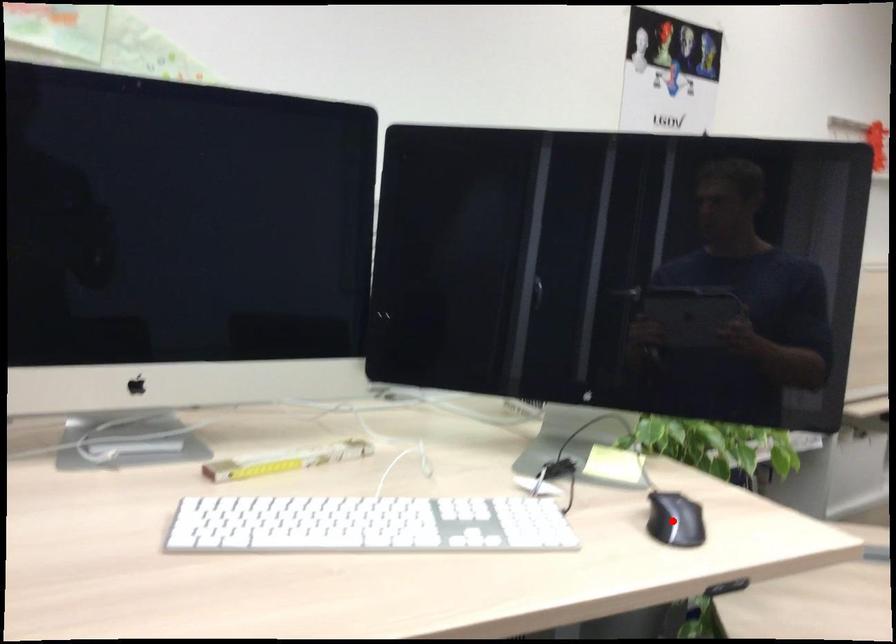
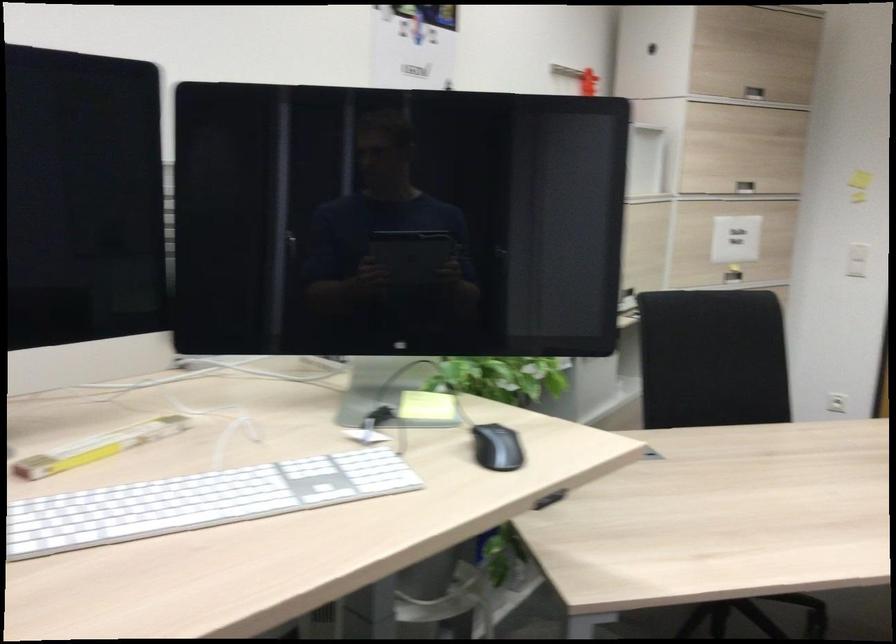
The point at the highlighted location is marked in the first image. Where is the corresponding point in the second image?

(496, 448)